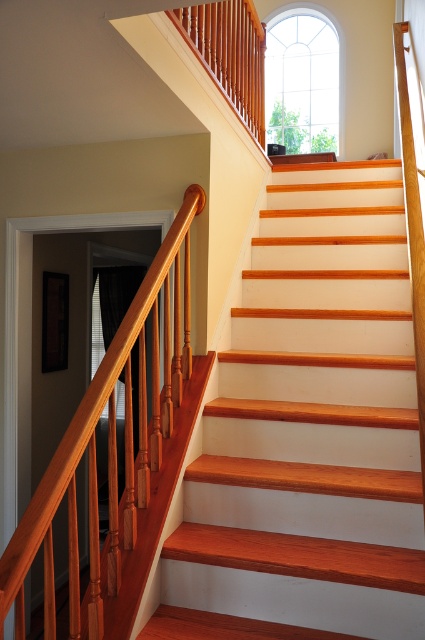
You are a painter who needs to paint the wooden stair at upper center and the polished wood handrail at left. You have two cans of paint, one for small objects and one for large objects. Which object should you use the small paint can on?

The wooden stair at upper center is smaller than the polished wood handrail at left, so you should use the small paint can on the wooden stair at upper center.

You are standing at the bottom of the staircase and want to reach the landing at the top. You notice the wooden stair at upper center and the polished wood handrail at left. Which object should you grab to ensure a safe ascent?

You should grab the polished wood handrail at left because it is positioned to the left of the wooden stair at upper center, providing a stable grip during ascent.

You are standing on the staircase and want to move towards the window above the stairs. You see two points marked on the image, point 1 at coordinates point (405, 264) and point 2 at coordinates point (108, 483). Which point should you move towards to reach the window?

Point 1 at coordinates point (405, 264) is behind point (108, 483), so moving towards point 1 would be closer to the window above the stairs.